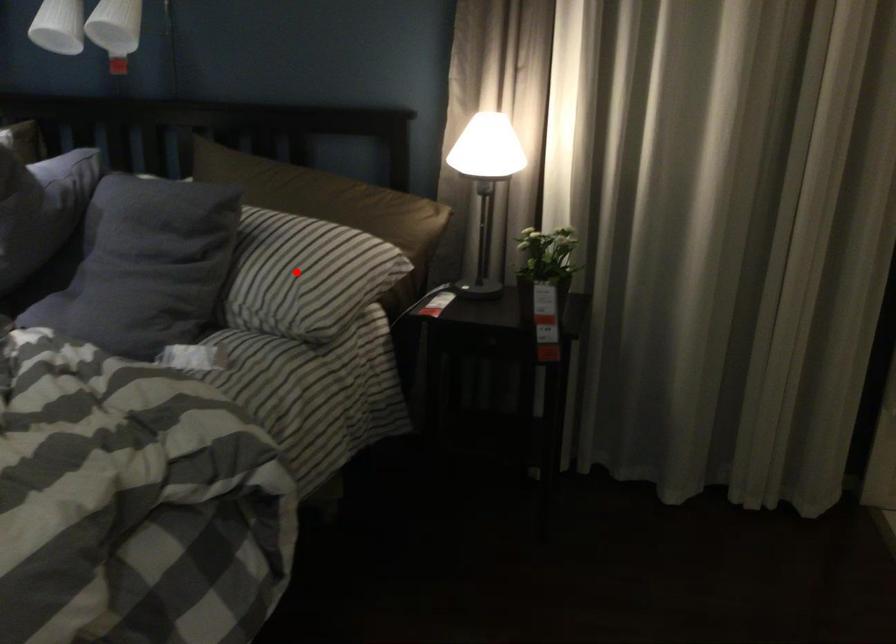
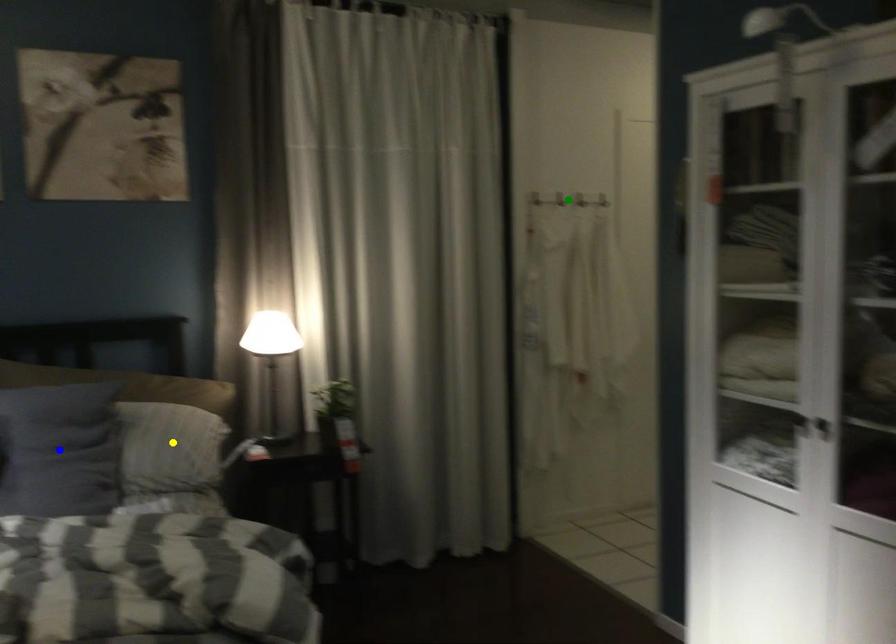
Question: I am providing you with two images of the same scene from different viewpoints. A red point is marked on the first image. You are given multiple points on the second image. In image 2, which mark is for the same physical point as the one in image 1?

Choices:
 (A) blue point
 (B) yellow point
 (C) green point

Answer: (B)